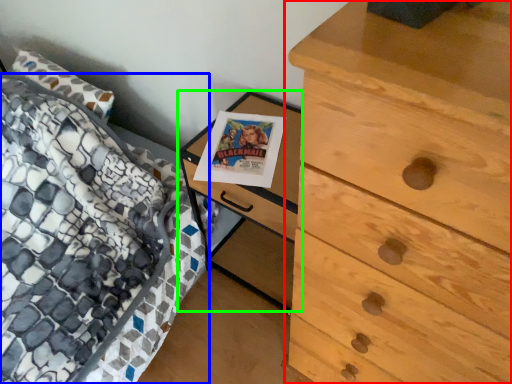
Question: Which object is the farthest from chest of drawers (highlighted by a red box)? Choose among these: bed (highlighted by a blue box) or nightstand (highlighted by a green box).

Choices:
 (A) bed
 (B) nightstand

Answer: (A)